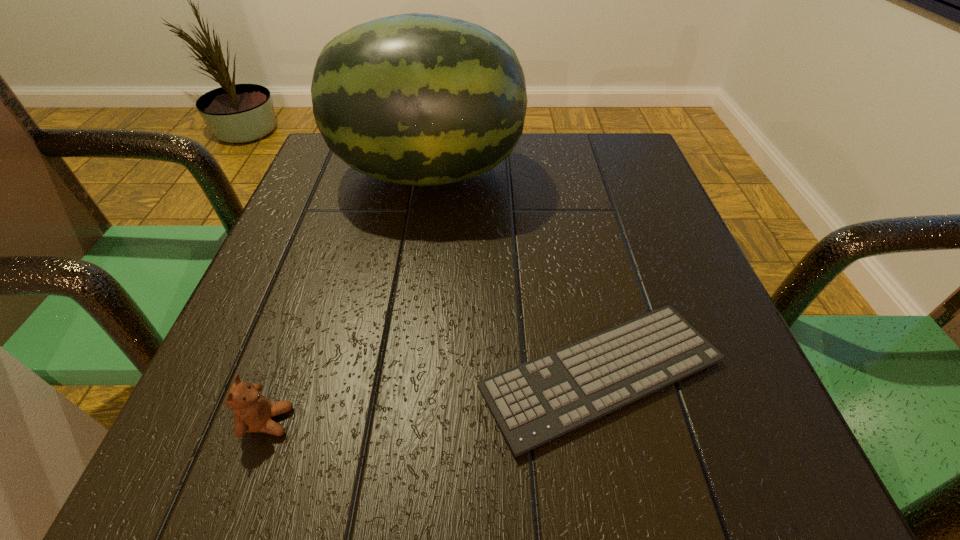
At what (x,y) coordinates should I click in order to perform the action: click on the farthest object. Please return your answer as a coordinate pair (x, y). Looking at the image, I should click on [x=417, y=99].

You are a GUI agent. You are given a task and a screenshot of the screen. Output one action in this format:
    pyautogui.click(x=<x>, y=<y>)
    Task: Click on the watermelon
    
    Given the screenshot: What is the action you would take?
    pyautogui.click(x=417, y=99)

At what (x,y) coordinates should I click in order to perform the action: click on the second tallest object. Please return your answer as a coordinate pair (x, y). The image size is (960, 540). Looking at the image, I should click on (253, 412).

Find the location of a particular element. the shortest object is located at coordinates 533,403.

At what (x,y) coordinates should I click in order to perform the action: click on vacant space located on the front of the tallest object. Please return your answer as a coordinate pair (x, y). Looking at the image, I should click on (405, 329).

Where is `vacant region located on the face of the teddy bear`? vacant region located on the face of the teddy bear is located at coordinates (417, 421).

Identify the location of blank area located on the left of the shortest object. Image resolution: width=960 pixels, height=540 pixels. (361, 374).

The width and height of the screenshot is (960, 540). Find the location of `object that is positioned at the far edge`. object that is positioned at the far edge is located at coordinates (417, 99).

In order to click on teddy bear present at the near edge in this screenshot , I will do `click(253, 412)`.

At what (x,y) coordinates should I click in order to perform the action: click on computer keyboard that is at the near edge. Please return your answer as a coordinate pair (x, y). Looking at the image, I should click on (533, 403).